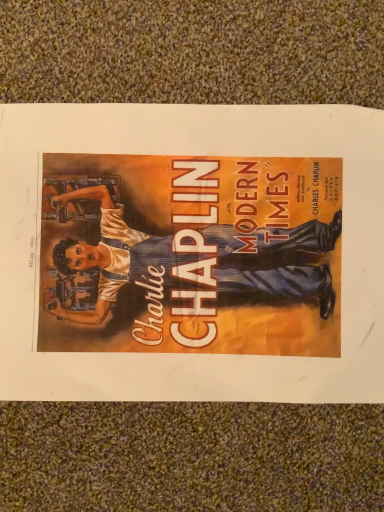
Find the location of `vacant point above matte blue overalls at center (from a real-world perspective)`. vacant point above matte blue overalls at center (from a real-world perspective) is located at coordinates (205, 261).